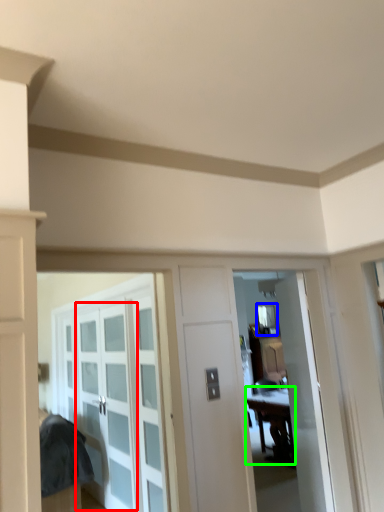
Question: Based on their relative distances, which object is farther from glass door (highlighted by a red box)? Choose from window (highlighted by a blue box) and table (highlighted by a green box).

Choices:
 (A) window
 (B) table

Answer: (A)